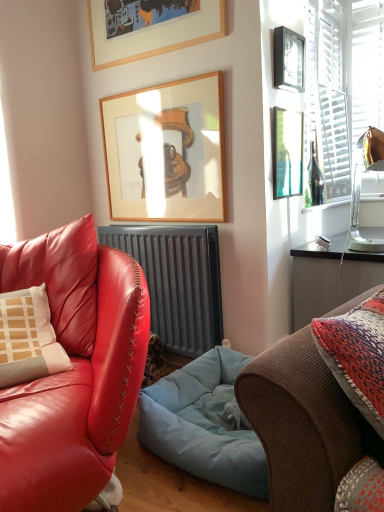
Question: From their relative heights in the image, would you say green glass bottle at upper right is taller or shorter than wooden picture frame at upper center, arranged as the 2th picture frame when ordered from the bottom?

Choices:
 (A) tall
 (B) short

Answer: (B)

Question: Looking at the image, does green glass bottle at upper right seem bigger or smaller compared to wooden picture frame at upper center, arranged as the 2th picture frame when ordered from the bottom?

Choices:
 (A) small
 (B) big

Answer: (A)

Question: Based on their relative distances, which object is nearer to the green glass bottle at upper right, the first picture frame from the bottom?

Choices:
 (A) brown textured couch at right, which is the first studio couch from right to left
 (B) matte black picture frame at upper right, the third picture frame ordered from the bottom
 (C) wooden picture frame at upper center, arranged as the 2th picture frame when ordered from the bottom
 (D) metallic gray radiator at center
 (E) metallic gold lampshade at upper right

Answer: (B)

Question: Which is farther from the metallic gold lampshade at upper right?

Choices:
 (A) wooden picture frame at upper center, arranged as the 2th picture frame when ordered from the bottom
 (B) metallic gray radiator at center
 (C) wooden picture frame at upper center, placed as the fourth picture frame when sorted from bottom to top
 (D) brown textured couch at right, which is the first studio couch from right to left
 (E) green glass bottle at upper right

Answer: (D)